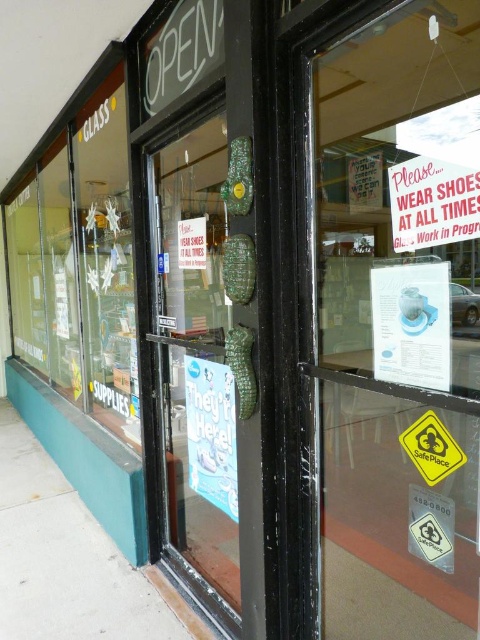
Based on the photo, what is the position of the transparent glass door at center relative to the white paper sign at upper right?

The transparent glass door at center is to the left of the white paper sign at upper right.